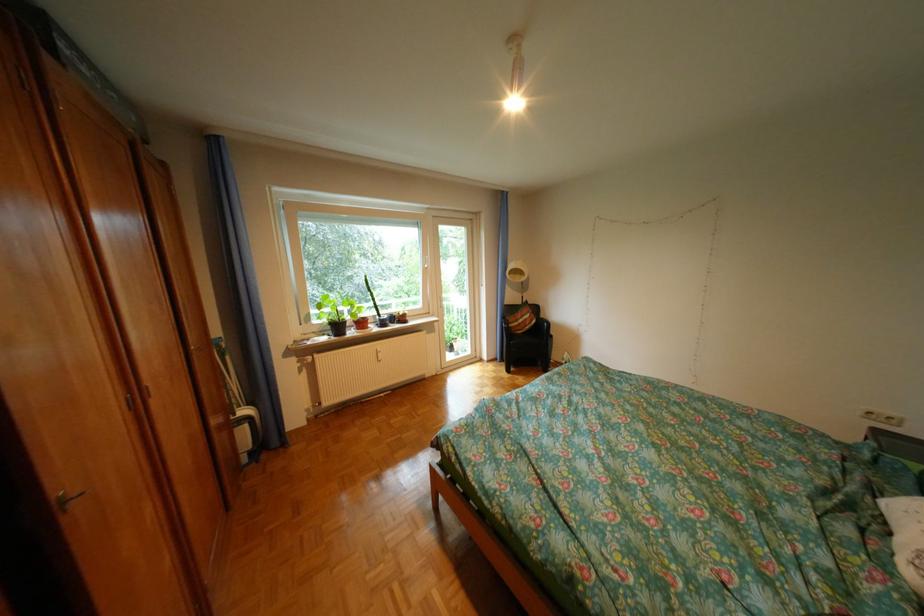
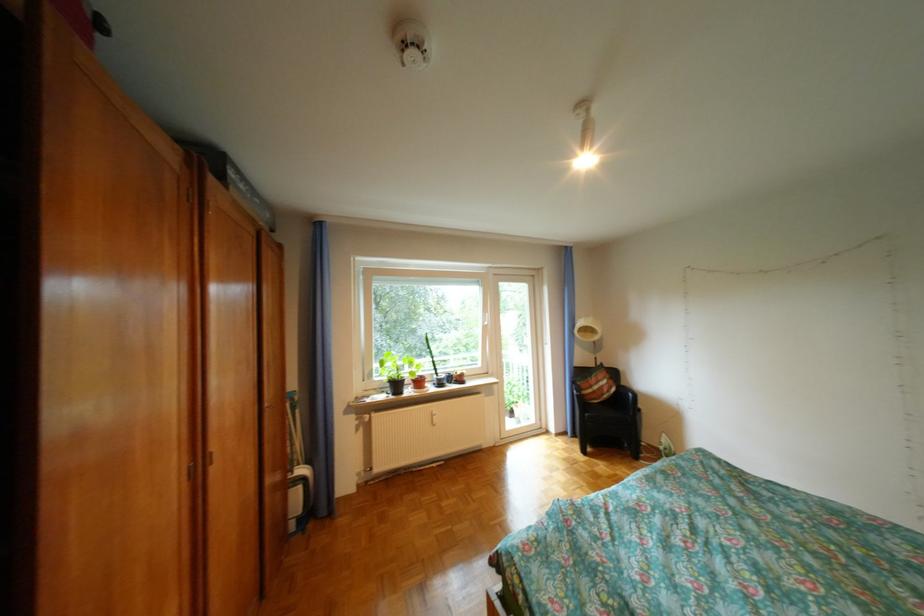
The point at [353,328] is marked in the first image. Where is the corresponding point in the second image?

(410, 386)